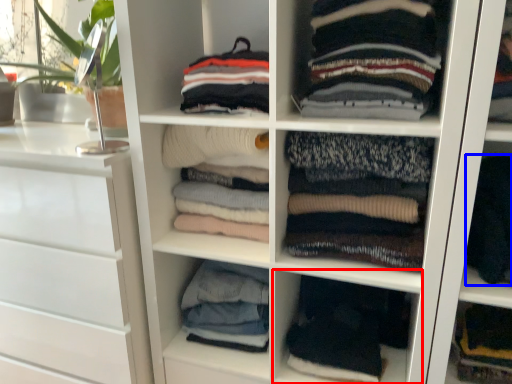
Question: Which object appears farthest to the camera in this image, shelf (highlighted by a red box) or clothing (highlighted by a blue box)?

Choices:
 (A) shelf
 (B) clothing

Answer: (A)